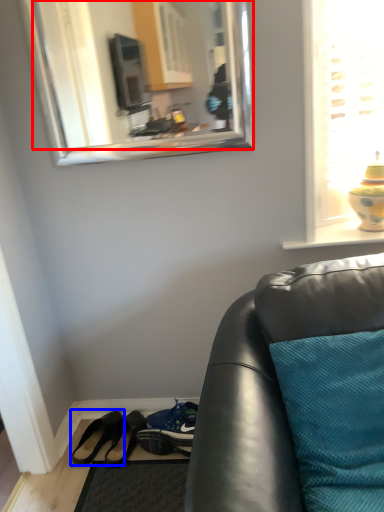
Question: Which object appears closest to the camera in this image, mirror (highlighted by a red box) or footwear (highlighted by a blue box)?

Choices:
 (A) mirror
 (B) footwear

Answer: (A)